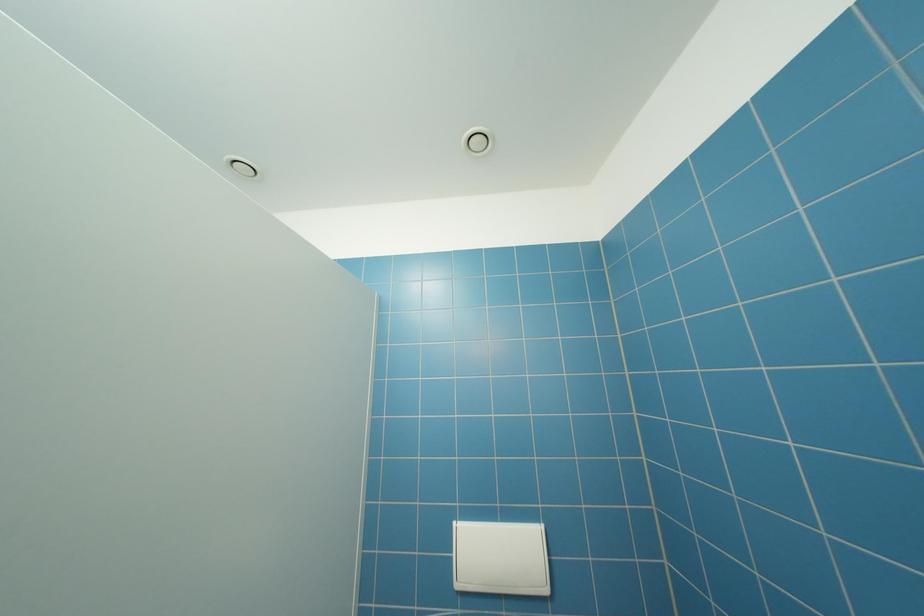
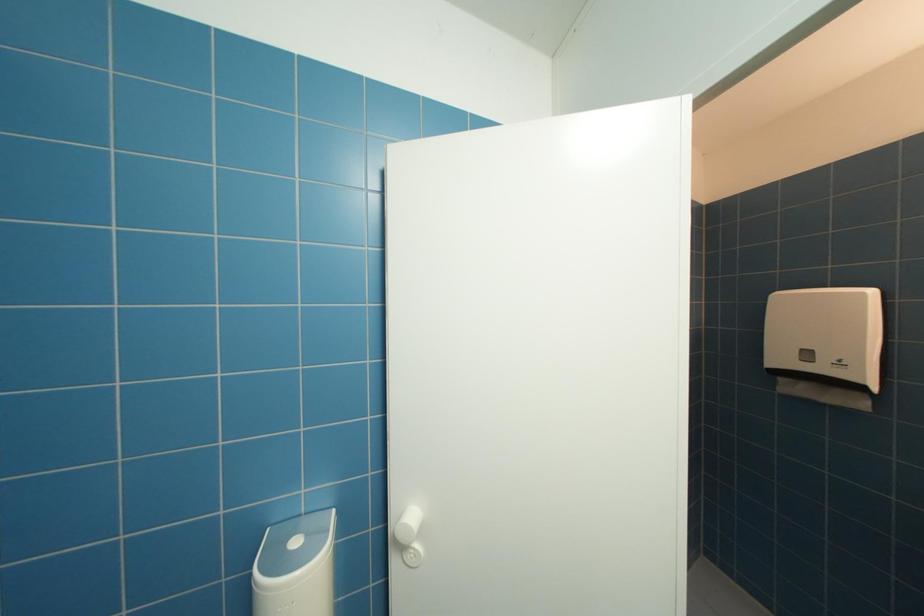
Question: The images are taken continuously from a first-person perspective. In which direction is your viewpoint rotating?

Choices:
 (A) Left
 (B) Right
 (C) Up
 (D) Down

Answer: (B)